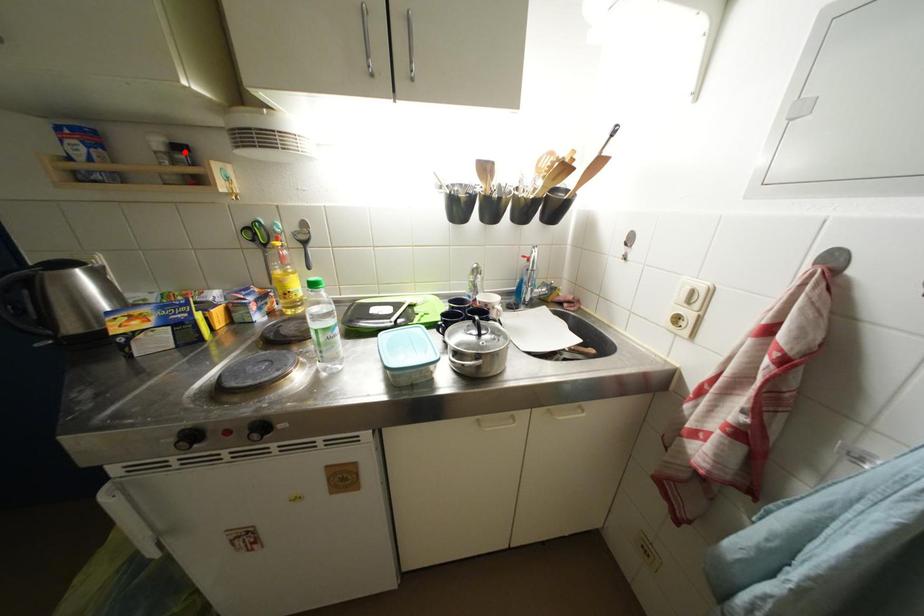
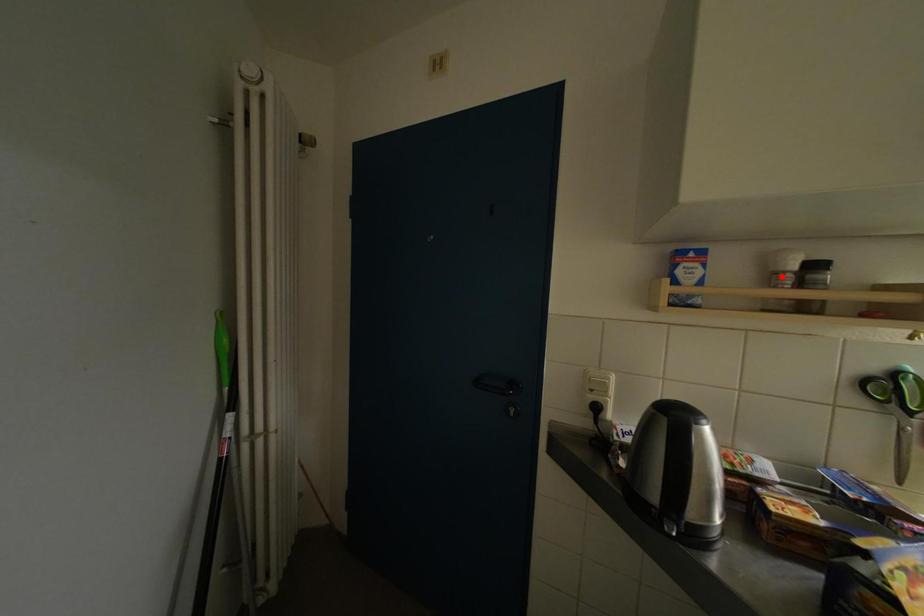
I am providing you with two images of the same scene from different viewpoints. A red point is marked on the first image and another point is marked on the second image. Is the red point in image1 aligned with the point shown in image2?

No